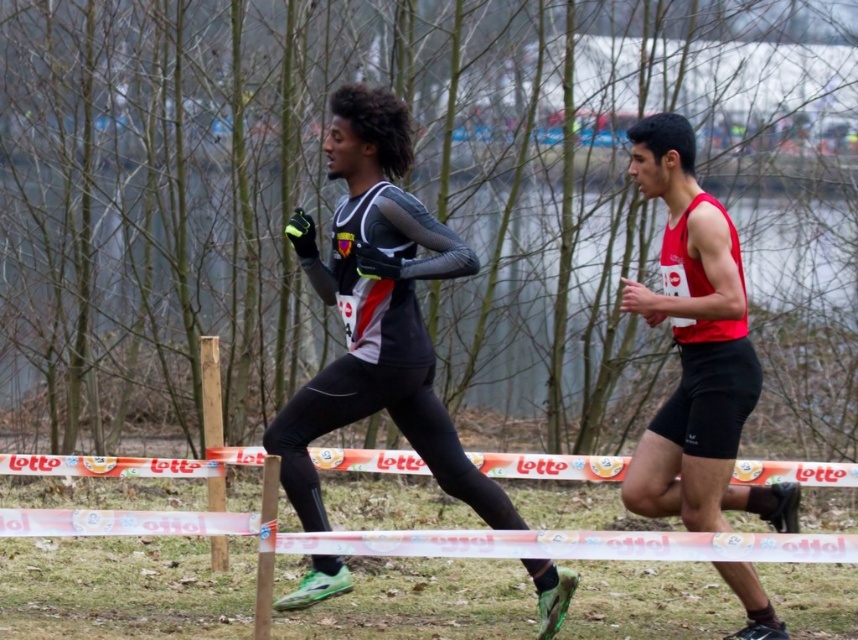
Question: Can you confirm if white plastic tape at center is thinner than matte black running suit at center?

Choices:
 (A) no
 (B) yes

Answer: (B)

Question: Is matte black running suit at center positioned at the back of matte red jersey at right?

Choices:
 (A) no
 (B) yes

Answer: (A)

Question: Which object is closer to the camera taking this photo?

Choices:
 (A) white plastic tape at center
 (B) matte black running suit at center

Answer: (B)

Question: Estimate the real-world distances between objects in this image. Which object is closer to the white plastic tape at center?

Choices:
 (A) matte red jersey at right
 (B) matte black running suit at center

Answer: (B)

Question: Is white plastic tape at center smaller than matte red jersey at right?

Choices:
 (A) yes
 (B) no

Answer: (A)

Question: Which point is farther to the camera?

Choices:
 (A) white plastic tape at center
 (B) matte red jersey at right
 (C) matte black running suit at center

Answer: (A)